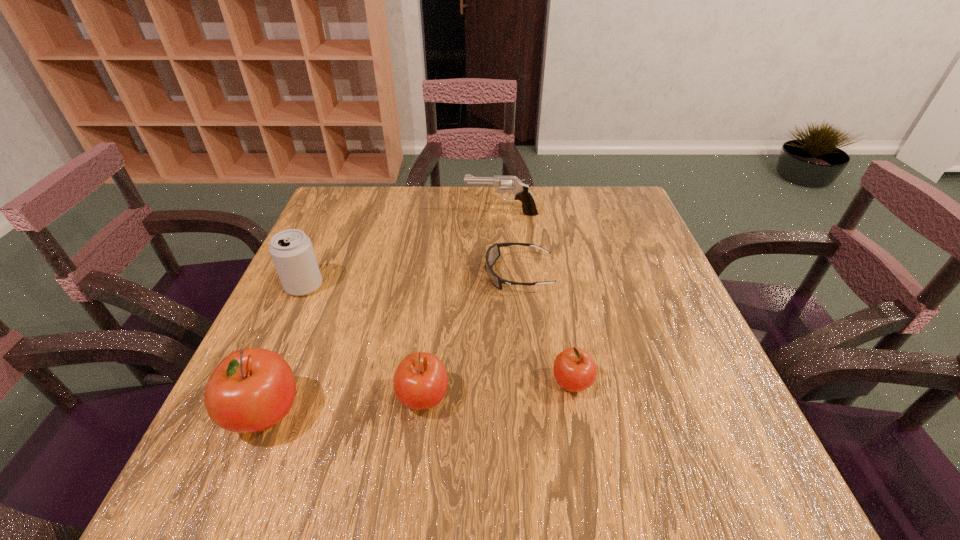
This screenshot has height=540, width=960. I want to click on can that is at the left edge, so click(291, 250).

In order to click on object that is at the near left corner in this screenshot , I will do `click(252, 389)`.

In the image, there is a desktop. Find the location of `free region at the far edge`. free region at the far edge is located at coordinates (440, 228).

This screenshot has height=540, width=960. In order to click on vacant space at the near edge in this screenshot , I will do `click(455, 422)`.

Identify the location of vacant space at the left edge of the desktop. Image resolution: width=960 pixels, height=540 pixels. (326, 256).

In the image, there is a desktop. Where is `free space at the right edge`? This screenshot has width=960, height=540. free space at the right edge is located at coordinates (636, 313).

The image size is (960, 540). Identify the location of vacant space at the near left corner of the desktop. (233, 435).

The height and width of the screenshot is (540, 960). In the image, there is a desktop. Identify the location of free space at the far right corner. (597, 207).

Locate an element on the screen. The width and height of the screenshot is (960, 540). free space at the near right corner is located at coordinates (671, 409).

Where is `vacant area between the tallest object and the shortest object`? This screenshot has width=960, height=540. vacant area between the tallest object and the shortest object is located at coordinates (392, 344).